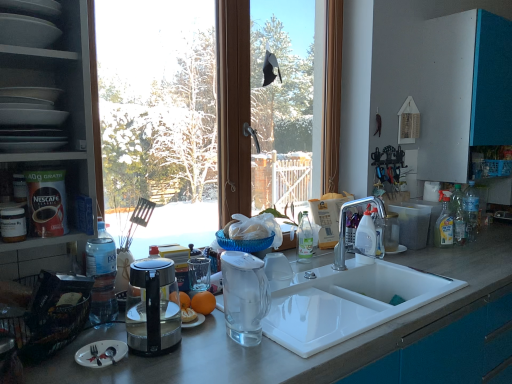
Image resolution: width=512 pixels, height=384 pixels. What are the coordinates of `vacant area that lies to the right of yellow liquid bottle at right` in the screenshot? It's located at (478, 248).